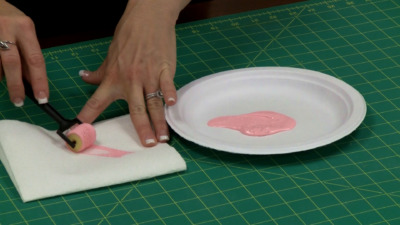
Where is `pink paint`? pink paint is located at coordinates (253, 122).